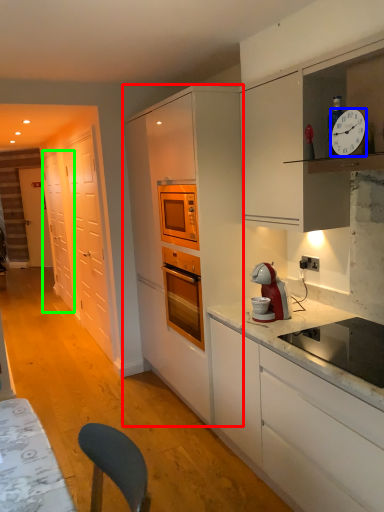
Question: Estimate the real-world distances between objects in this image. Which object is closer to cabinetry (highlighted by a red box), clock (highlighted by a blue box) or glass door (highlighted by a green box)?

Choices:
 (A) clock
 (B) glass door

Answer: (A)